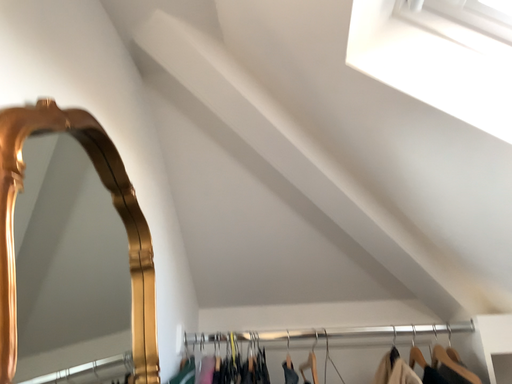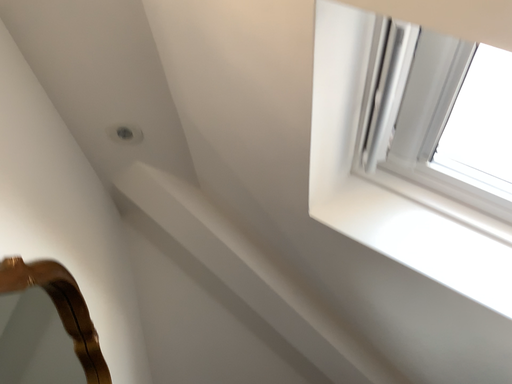
Question: Which way did the camera rotate in the video?

Choices:
 (A) rotated upward
 (B) rotated downward

Answer: (A)